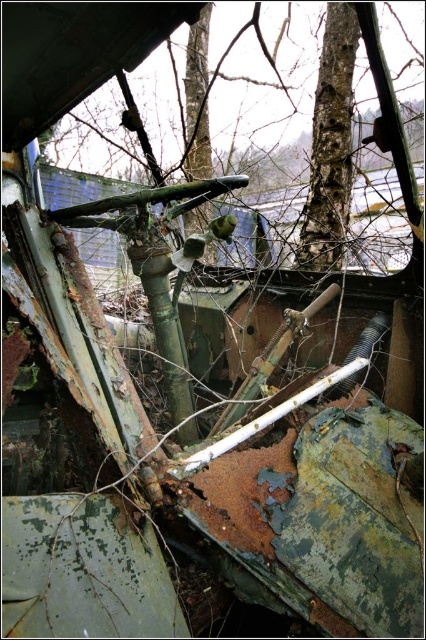
You are standing outside the damaged vehicle and see the green camouflage tree at center and the rough bark tree at upper center. Which tree is closer to you?

The green camouflage tree at center is closer to you because it is further to the viewer than the rough bark tree at upper center.